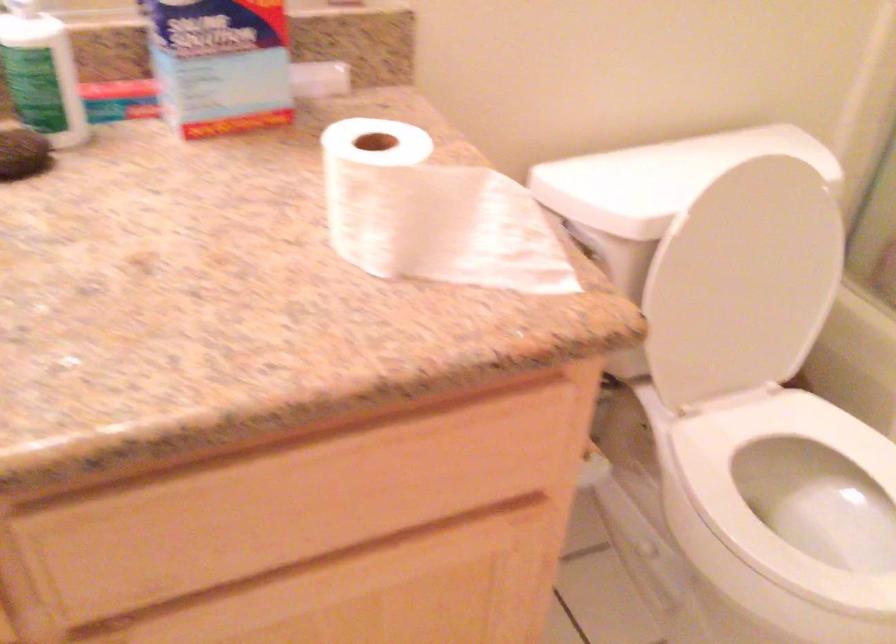
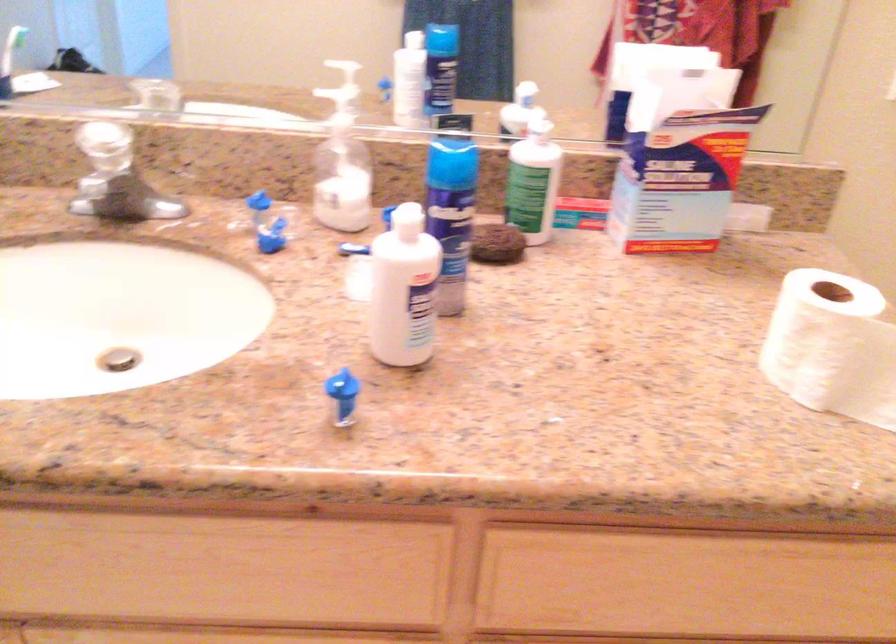
Locate, in the second image, the point that corresponds to [389,204] in the first image.

(831, 346)